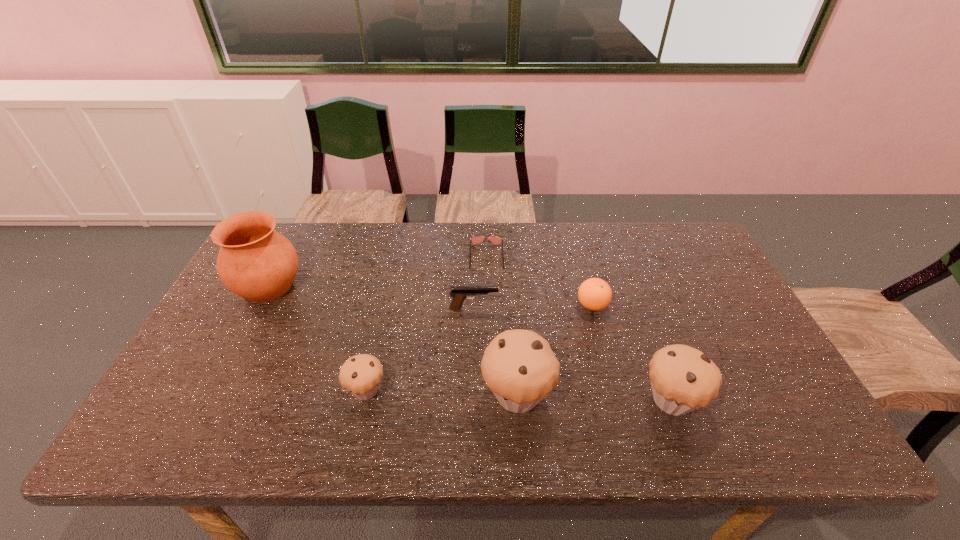
The image size is (960, 540). I want to click on free space located 0.360m on the left of the leftmost muffin, so click(194, 390).

In order to click on free space located on the right of the second muffin from right to left in this screenshot , I will do [x=635, y=395].

I want to click on free location located on the back of the fifth shortest object, so click(x=640, y=314).

Where is `vacant region located 0.090m on the bridge of the sunglasses`? This screenshot has height=540, width=960. vacant region located 0.090m on the bridge of the sunglasses is located at coordinates (487, 289).

You are a GUI agent. You are given a task and a screenshot of the screen. Output one action in this format:
    pyautogui.click(x=<x>, y=<y>)
    Task: Click on the blank space located 0.070m at the muzzle of the pistol
    Image resolution: width=960 pixels, height=540 pixels.
    Given the screenshot: What is the action you would take?
    pyautogui.click(x=523, y=308)

This screenshot has height=540, width=960. What are the coordinates of `free space located on the back of the tallest object` in the screenshot? It's located at (299, 228).

Where is `vacant space situated 0.190m on the back of the orange`? Image resolution: width=960 pixels, height=540 pixels. vacant space situated 0.190m on the back of the orange is located at coordinates (579, 254).

What are the coordinates of `sunglasses at the far edge` in the screenshot? It's located at (496, 240).

I want to click on pottery positioned at the far edge, so click(256, 262).

What are the coordinates of `object situated at the left edge` in the screenshot? It's located at (256, 262).